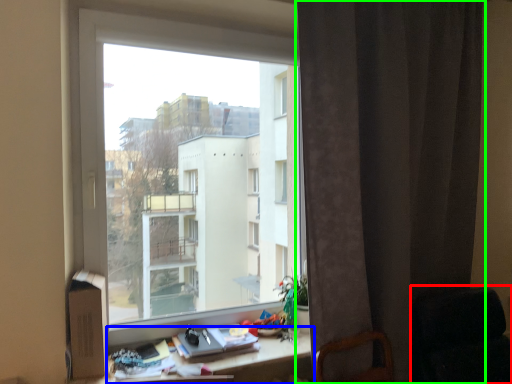
Question: Which object is the closest to the rocking chair (highlighted by a red box)? Choose among these: desk (highlighted by a blue box) or curtain (highlighted by a green box).

Choices:
 (A) desk
 (B) curtain

Answer: (B)